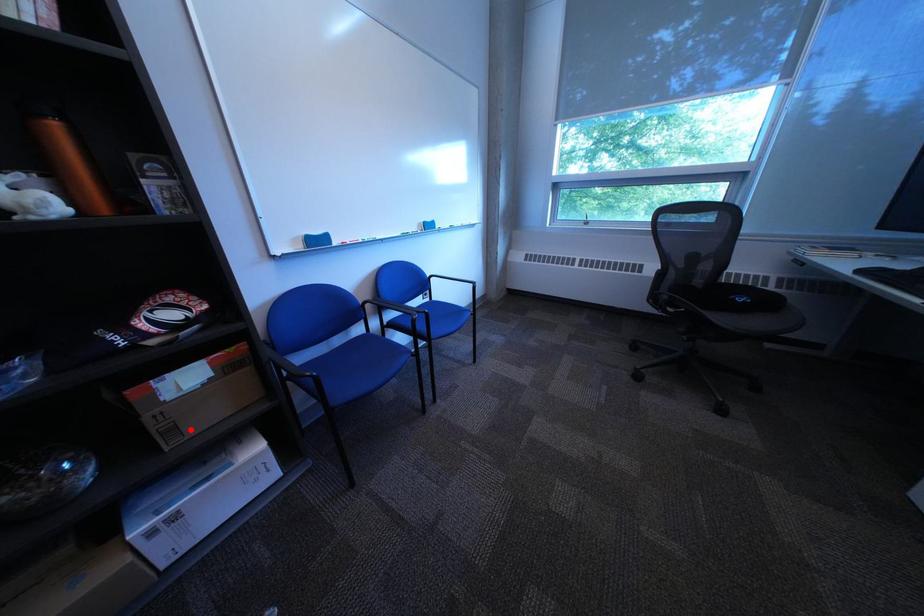
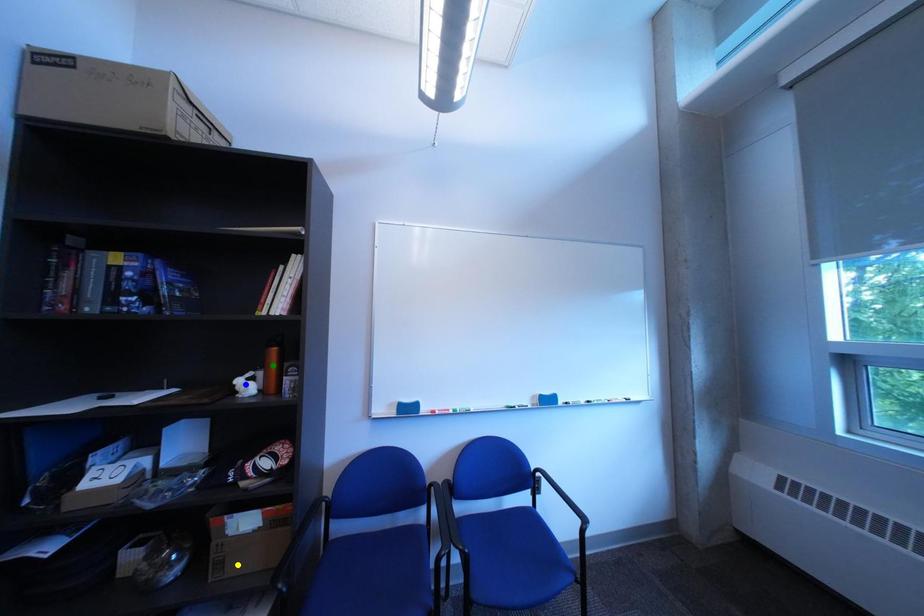
Question: I am providing you with two images of the same scene from different viewpoints. A red point is marked on the first image. You are given multiple points on the second image. In image 2, which mark is for the same physical point as the one in image 1?

Choices:
 (A) yellow point
 (B) green point
 (C) blue point

Answer: (A)